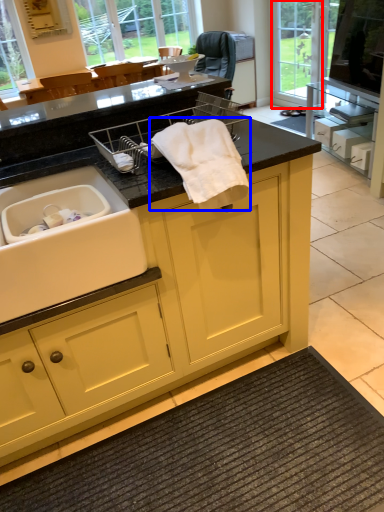
Question: Which object is closer to the camera taking this photo, glass door (highlighted by a red box) or bath towel (highlighted by a blue box)?

Choices:
 (A) glass door
 (B) bath towel

Answer: (B)